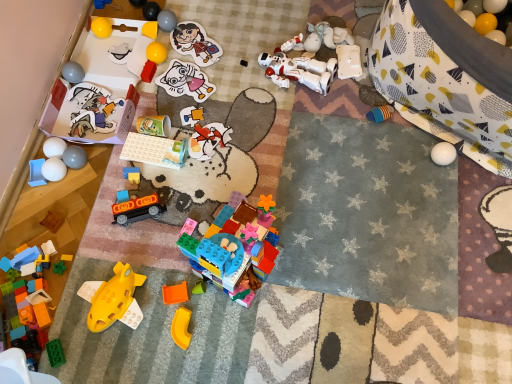
Locate an element on the screen. free space between matte paper sticker at upper center, which is counted as the twentieth toy, starting from the left, and matte paper sticker at center, the nineteenth toy when ordered from left to right is located at coordinates (192, 68).